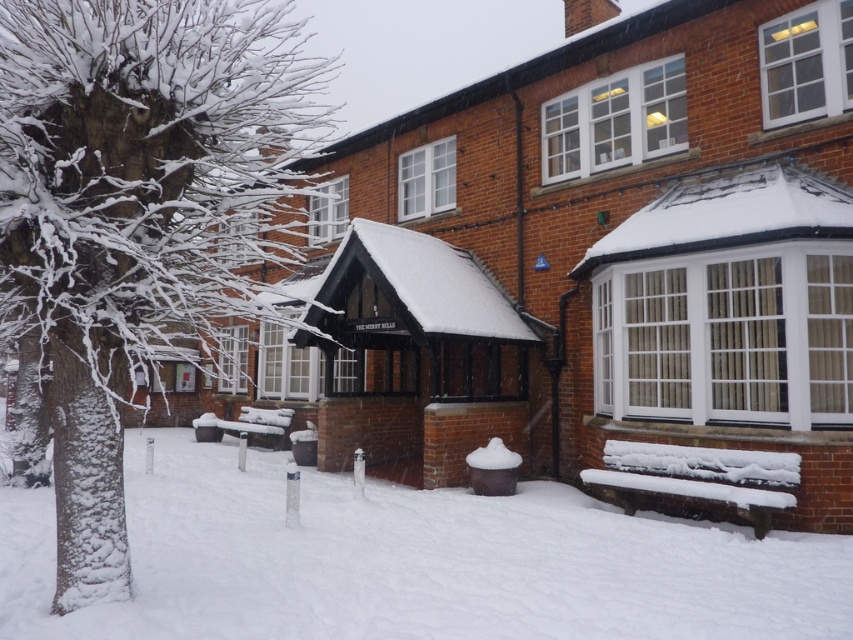
Question: In this image, where is snow-covered tree at left located relative to snow-covered wooden bench at lower right?

Choices:
 (A) left
 (B) right

Answer: (A)

Question: Considering the relative positions of snow-covered wooden bench at lower right and wooden bench at center in the image provided, where is snow-covered wooden bench at lower right located with respect to wooden bench at center?

Choices:
 (A) right
 (B) left

Answer: (A)

Question: Among these points, which one is nearest to the camera?

Choices:
 (A) (712, 497)
 (B) (94, 60)
 (C) (254, 417)

Answer: (B)

Question: Is snow-covered tree at left to the right of white fluffy snow at lower center from the viewer's perspective?

Choices:
 (A) yes
 (B) no

Answer: (B)

Question: Among these points, which one is farthest from the camera?

Choices:
 (A) (639, 490)
 (B) (273, 184)

Answer: (B)

Question: Based on their relative distances, which object is farther from the snow-covered tree at left?

Choices:
 (A) white fluffy snow at lower center
 (B) snow-covered wooden bench at lower right

Answer: (B)